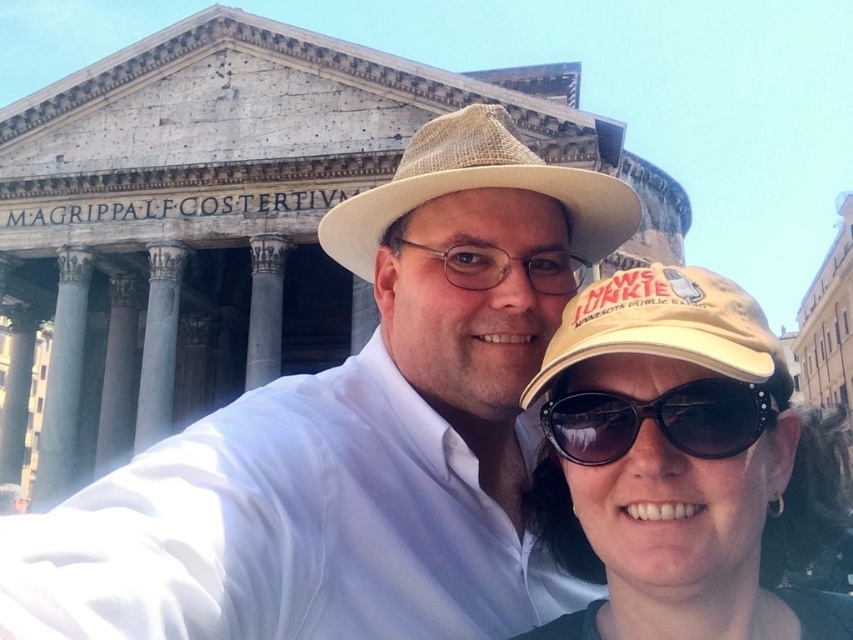
You are a photographer trying to frame a shot of the two people wearing hats in front of the Pantheon. The white woven hat at center and beige straw hat at center are both in your viewfinder. Based on their widths, which hat should you adjust your focus to ensure both hats fit comfortably in the frame?

The white woven hat at center might be wider than beige straw hat at center, so you should adjust your focus to accommodate the width of the white woven hat at center to ensure both hats fit comfortably in the frame.

You are a photographer trying to capture the selfie scene. You need to ensure the white woven hat at center and the black reflective sunglasses at lower center are both visible in the frame. Based on their positions, which object should you prioritize keeping in the center of your camera viewfinder to ensure both are in the shot?

The white woven hat at center is to the left of black reflective sunglasses at lower center. To ensure both are in the frame, prioritize keeping the black reflective sunglasses at lower center in the center of the viewfinder since it is positioned more towards the right, allowing the white woven hat at center to remain visible on its left side.